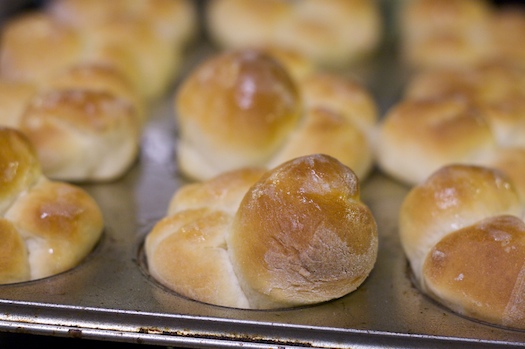
What are the coordinates of `silver baking tray` in the screenshot? It's located at (109, 297).